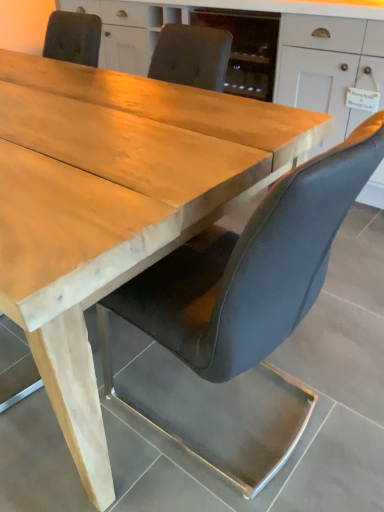
Question: Is leather-like black chair at center wider or thinner than matte white cabinet at upper center?

Choices:
 (A) wide
 (B) thin

Answer: (B)

Question: Looking at the image, does leather-like black chair at center seem bigger or smaller compared to matte white cabinet at upper center?

Choices:
 (A) big
 (B) small

Answer: (B)

Question: In terms of height, does leather-like black chair at center look taller or shorter compared to matte white cabinet at upper center?

Choices:
 (A) tall
 (B) short

Answer: (B)

Question: Considering the positions of matte white cabinet at upper center and leather-like black chair at center in the image, is matte white cabinet at upper center taller or shorter than leather-like black chair at center?

Choices:
 (A) short
 (B) tall

Answer: (B)

Question: From the image's perspective, is matte white cabinet at upper center located above or below leather-like black chair at center?

Choices:
 (A) below
 (B) above

Answer: (B)

Question: Considering the relative positions of matte white cabinet at upper center and leather-like black chair at center in the image provided, is matte white cabinet at upper center to the left or to the right of leather-like black chair at center?

Choices:
 (A) right
 (B) left

Answer: (A)

Question: Considering the positions of point [x=336, y=138] and point [x=196, y=279], is point [x=336, y=138] closer or farther from the camera than point [x=196, y=279]?

Choices:
 (A) farther
 (B) closer

Answer: (A)